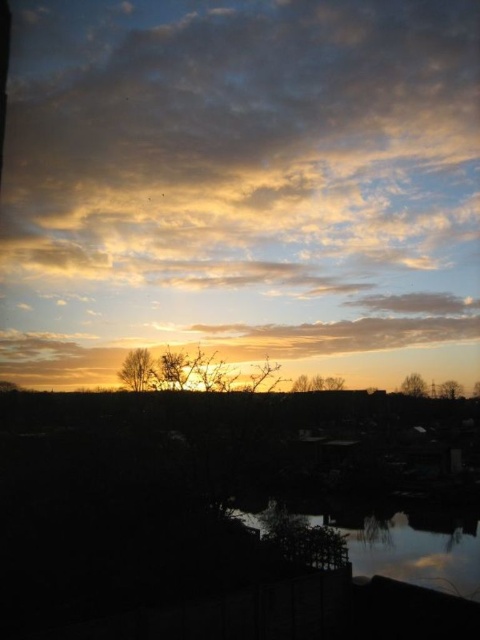
Does golden/yellow cloud at center have a lesser height compared to reflective glass water at lower center?

In fact, golden/yellow cloud at center may be taller than reflective glass water at lower center.

Is point (109, 8) closer to camera compared to point (434, 586)?

No, it is behind (434, 586).

You are a GUI agent. You are given a task and a screenshot of the screen. Output one action in this format:
    pyautogui.click(x=<x>, y=<y>)
    Task: Click on the golden/yellow cloud at center
    
    Given the screenshot: What is the action you would take?
    pyautogui.click(x=241, y=186)